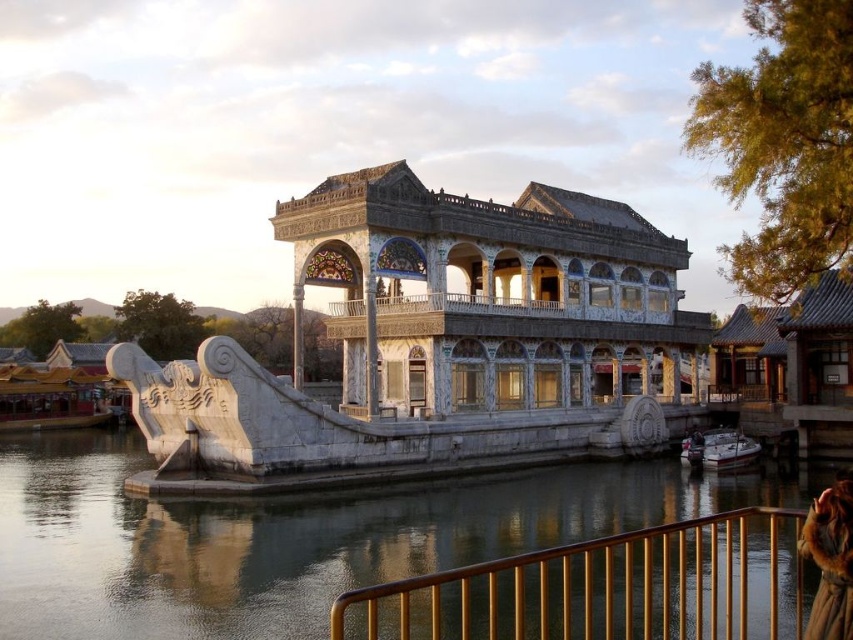
Question: Estimate the real-world distances between objects in this image. Which object is closer to the gold polished metal railing at lower center?

Choices:
 (A) white glossy boat at lower right
 (B) fuzzy brown fur coat at lower right
 (C) white marble palace at center

Answer: (B)

Question: Estimate the real-world distances between objects in this image. Which object is closer to the white glossy boat at lower right?

Choices:
 (A) fuzzy brown fur coat at lower right
 (B) white marble palace at center
 (C) smooth gray water at lower center

Answer: (A)

Question: Does gold polished metal railing at lower center have a lesser width compared to fuzzy brown fur coat at lower right?

Choices:
 (A) no
 (B) yes

Answer: (A)

Question: Estimate the real-world distances between objects in this image. Which object is closer to the fuzzy brown fur coat at lower right?

Choices:
 (A) white glossy boat at lower right
 (B) gold polished metal railing at lower center

Answer: (B)

Question: Is white marble palace at center above white glossy boat at lower right?

Choices:
 (A) no
 (B) yes

Answer: (B)

Question: Is smooth gray water at lower center positioned behind white glossy boat at lower right?

Choices:
 (A) yes
 (B) no

Answer: (B)